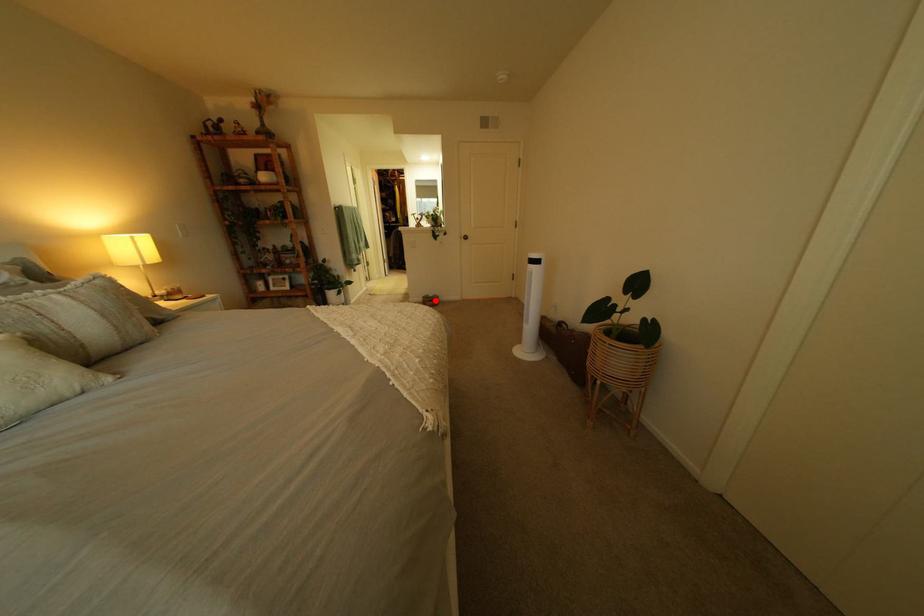
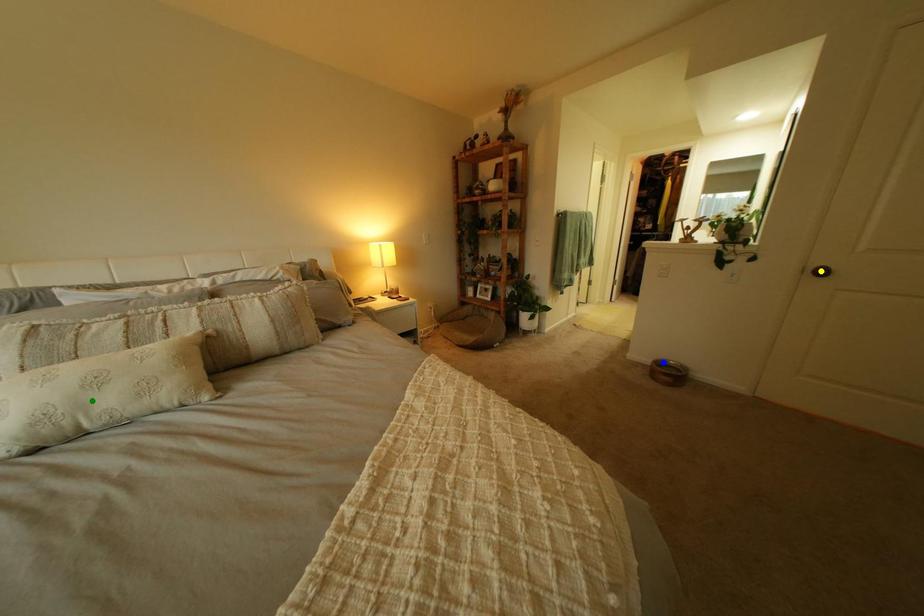
Question: I am providing you with two images of the same scene from different viewpoints. A red point is marked on the first image. You are given multiple points on the second image. Can you choose the point in image 2 that corresponds to the point in image 1?

Choices:
 (A) green point
 (B) blue point
 (C) yellow point

Answer: (B)